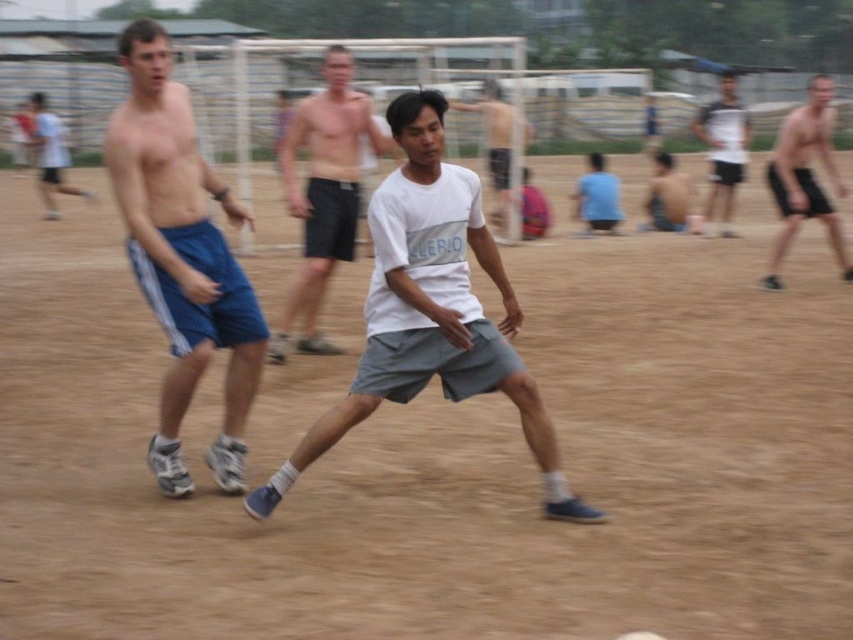
Question: Is blue athletic shorts at left above white matte shirt at upper right?

Choices:
 (A) no
 (B) yes

Answer: (A)

Question: Does white cotton t-shirt at center appear on the left side of white matte shirt at center?

Choices:
 (A) no
 (B) yes

Answer: (A)

Question: Considering the real-world distances, which object is closest to the light blue t-shirt at center?

Choices:
 (A) matte black shorts at right
 (B) white matte shirt at center
 (C) white cotton t-shirt at center

Answer: (A)

Question: Which of the following is the farthest from the observer?

Choices:
 (A) [x=654, y=156]
 (B) [x=717, y=188]
 (C) [x=334, y=44]

Answer: (A)

Question: Which point is closer to the camera?

Choices:
 (A) (602, 182)
 (B) (341, 51)
 (C) (718, 108)
 (D) (146, 216)

Answer: (D)

Question: Does blue athletic shorts at left lie in front of white matte shirt at center?

Choices:
 (A) no
 (B) yes

Answer: (B)